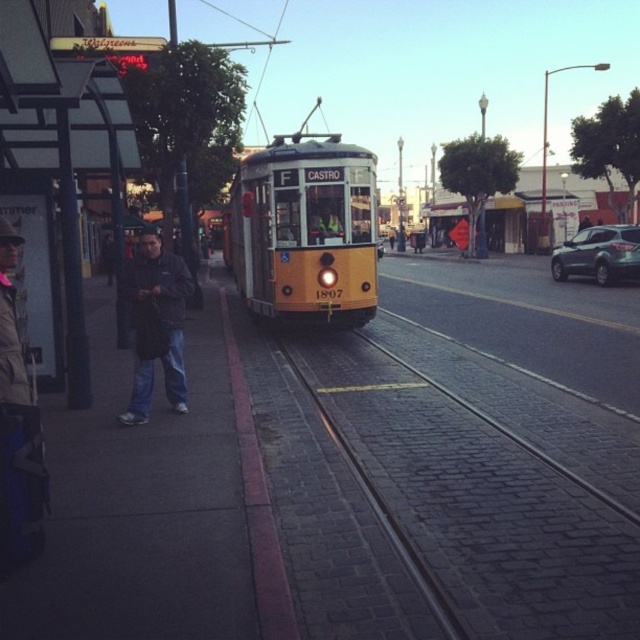
Between dark blue jacket at left and dark gray jacket at left, which one has more height?

dark gray jacket at left is taller.

Which is in front, point (186, 275) or point (106, 278)?

Point (186, 275)

I want to click on dark blue jacket at left, so click(156, 323).

Between point (611, 628) and point (168, 280), which one is positioned in front?

Point (611, 628) is in front.

Does brick paved train track at center have a greater height compared to dark blue jacket at left?

Yes.

Does point (540, 624) lie behind point (132, 390)?

No, (540, 624) is in front of (132, 390).

This screenshot has width=640, height=640. Identify the location of brick paved train track at center. (449, 493).

Does brick paved train track at center appear on the right side of denim jacket at left?

Correct, you'll find brick paved train track at center to the right of denim jacket at left.

Which of these two, brick paved train track at center or denim jacket at left, stands shorter?

brick paved train track at center

Is point (529, 506) less distant than point (17, 369)?

That is False.

The height and width of the screenshot is (640, 640). I want to click on brick paved train track at center, so click(449, 493).